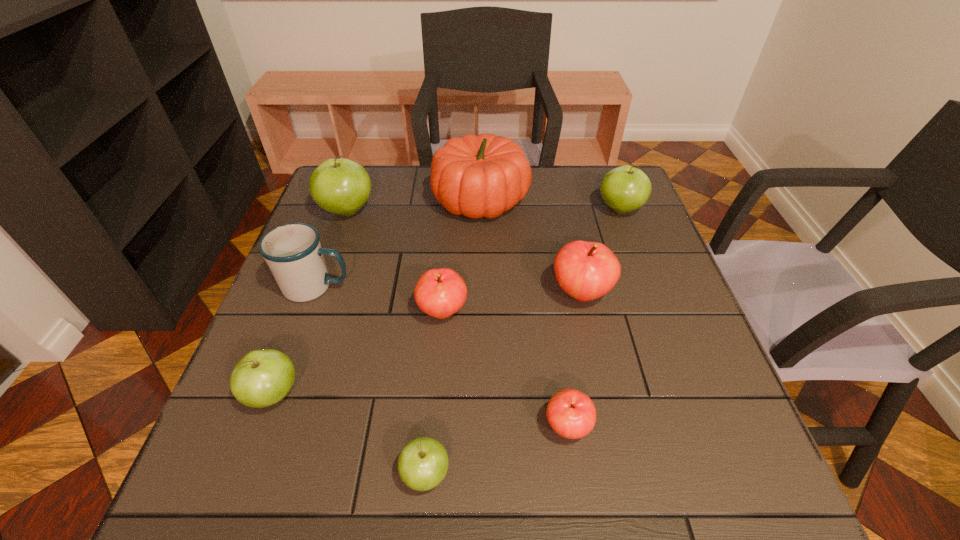
Identify the location of blank area in the image that satisfies the following two spatial constraints: 1. on the back side of the biggest red apple; 2. on the handle side of the white mug. (580, 287).